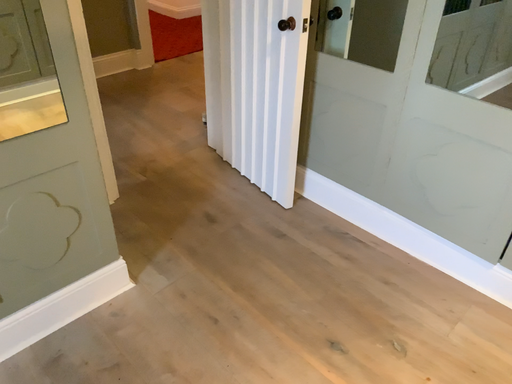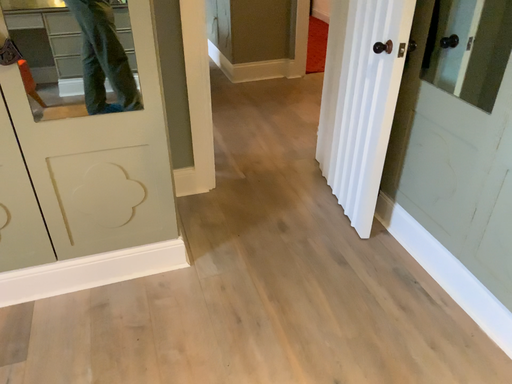
Question: Which way did the camera rotate in the video?

Choices:
 (A) rotated left
 (B) rotated right

Answer: (A)